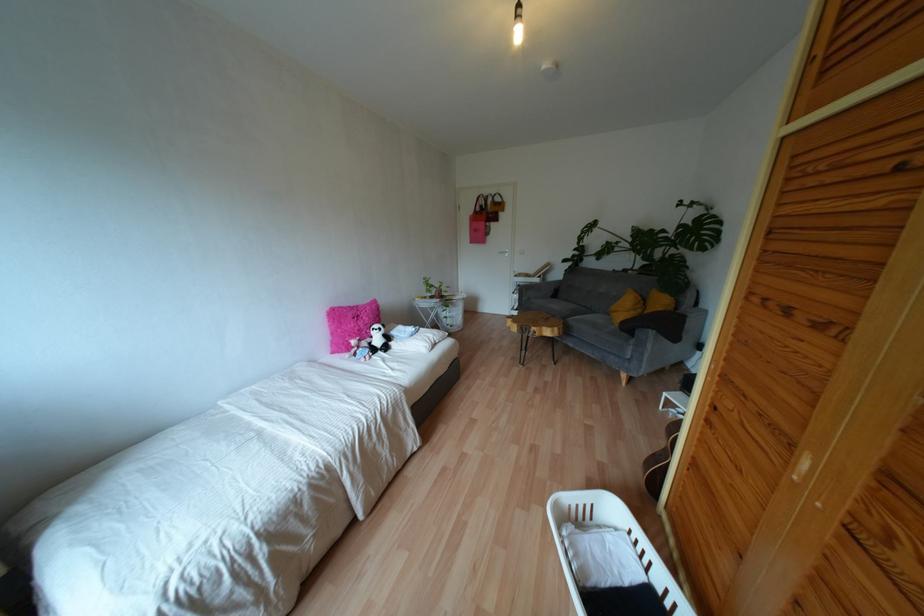
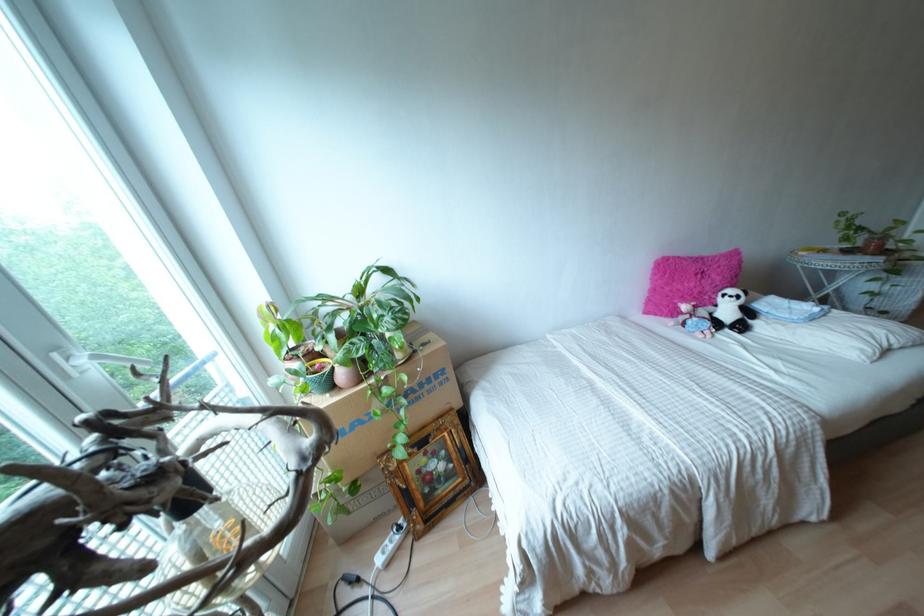
Where in the second image is the point corresponding to [338,330] from the first image?

(666, 288)